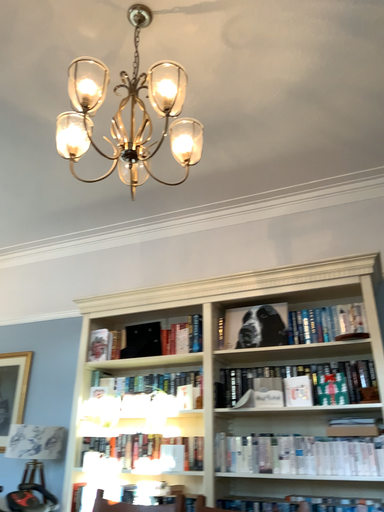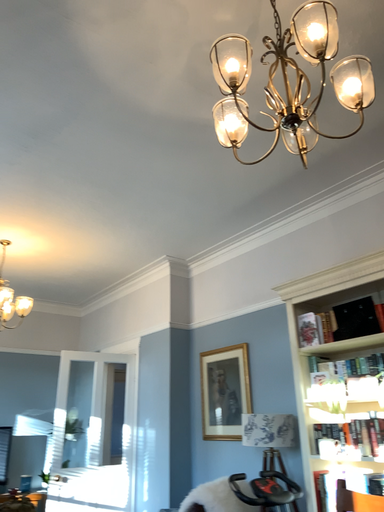
Question: How did the camera likely rotate when shooting the video?

Choices:
 (A) rotated right
 (B) rotated left

Answer: (B)